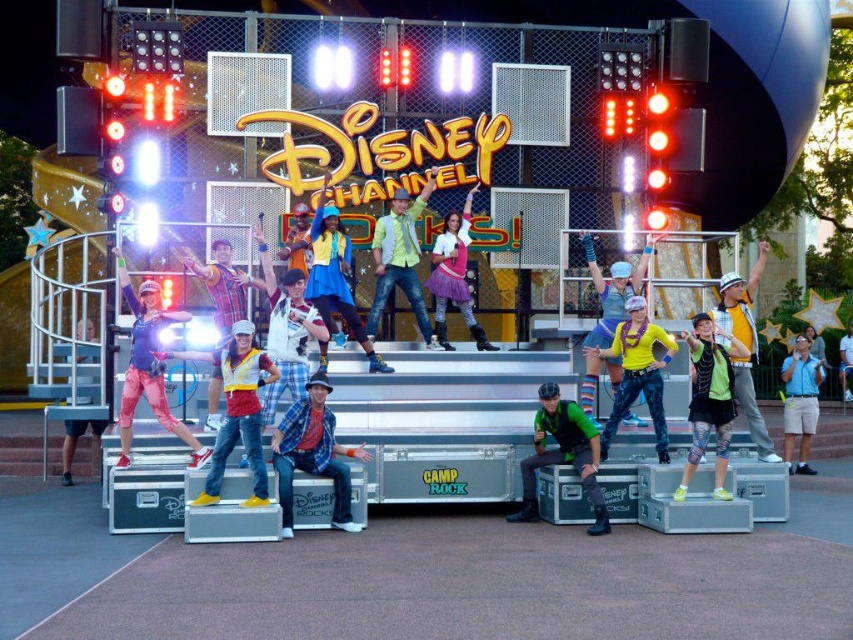
You are a photographer at the Camp Rock event. You need to capture a photo where both the pink satin skirt at center and the light blue denim shorts at lower right are visible. Considering their widths, which object should be placed closer to the camera to ensure both fit in the frame?

The pink satin skirt at center has a lesser width compared to the light blue denim shorts at lower right. To ensure both fit in the frame, the pink satin skirt at center should be placed closer to the camera since its narrower width requires less space, allowing the wider light blue denim shorts at lower right to be accommodated in the shot.

You are a photographer at the Camp Rock event and need to capture a closeup of both the yellow shiny shirt at center and the pink satin skirt at center. Since your camera can only focus on one object at a time, which object should you focus on first to ensure the smaller one is in clear view?

The yellow shiny shirt at center is smaller than the pink satin skirt at center, so you should focus on the yellow shiny shirt at center first to ensure its details are captured clearly before adjusting for the larger pink satin skirt at center.

You are standing at the point labeled as point [436,280]. If you want to walk towards the point labeled as point [724,296], which direction should you move relative to your current position?

You should move forward because point [724,296] is in front of point [436,280].